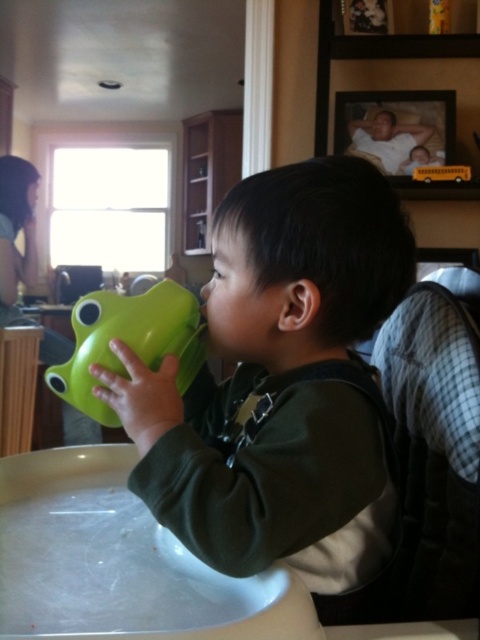
In the scene shown: You are a parent preparing a snack for your child. You have two toys, the green rubber cup at center and the green rubber duck at center, both on the table. Which one should you move to avoid blocking the child? Please explain your choice based on their sizes.

The green rubber cup at center is bigger than the green rubber duck at center. Since the cup takes up more space, it would be better to move the green rubber cup at center to avoid blocking the child.

You are standing in the room and want to reach the point at coordinates point (217, 552). If your arm can extend 22 inches, can you reach it without moving?

The point (217, 552) is 20.08 inches from the viewer, so yes, your arm can reach it since it extends 22 inches which is longer than the distance.

You are standing in the room and want to place a new decorative item at the point marked by coordinates (283, 387). What object is currently located there?

The green rubber cup at center is located at point (283, 387).